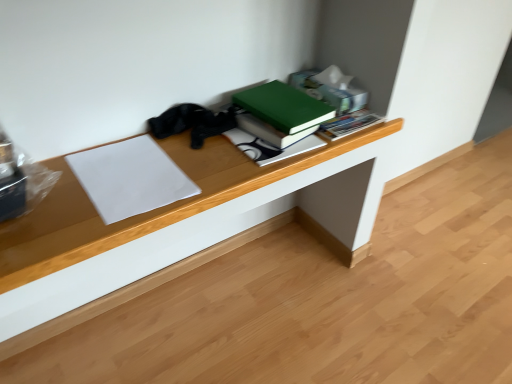
Question: Is white paper at left, which is counted as the 2th paperback book, starting from the back, to the left or to the right of green matte book at upper center, acting as the first paperback book starting from the right, in the image?

Choices:
 (A) left
 (B) right

Answer: (A)

Question: Considering the positions of point (115, 153) and point (287, 84), is point (115, 153) closer or farther from the camera than point (287, 84)?

Choices:
 (A) farther
 (B) closer

Answer: (B)

Question: Which object is the closest to the green matte book at upper center, positioned as the second paperback book in left-to-right order?

Choices:
 (A) wooden desk at center
 (B) white paper at left, placed as the first paperback book when sorted from bottom to top

Answer: (A)

Question: Estimate the real-world distances between objects in this image. Which object is closer to the green matte book at upper center, which is counted as the 2th paperback book, starting from the front?

Choices:
 (A) white paper at left, the first paperback book positioned from the left
 (B) wooden desk at center

Answer: (B)